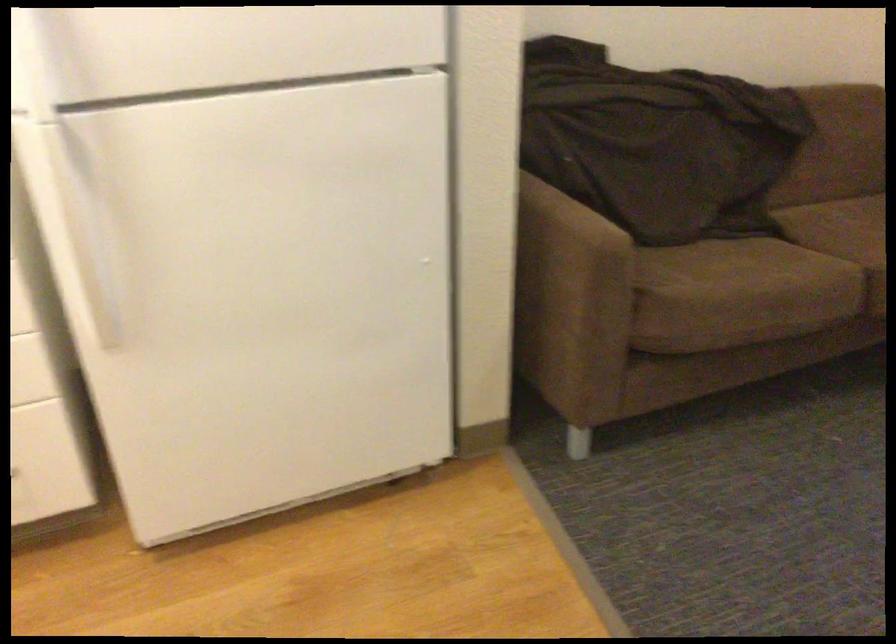
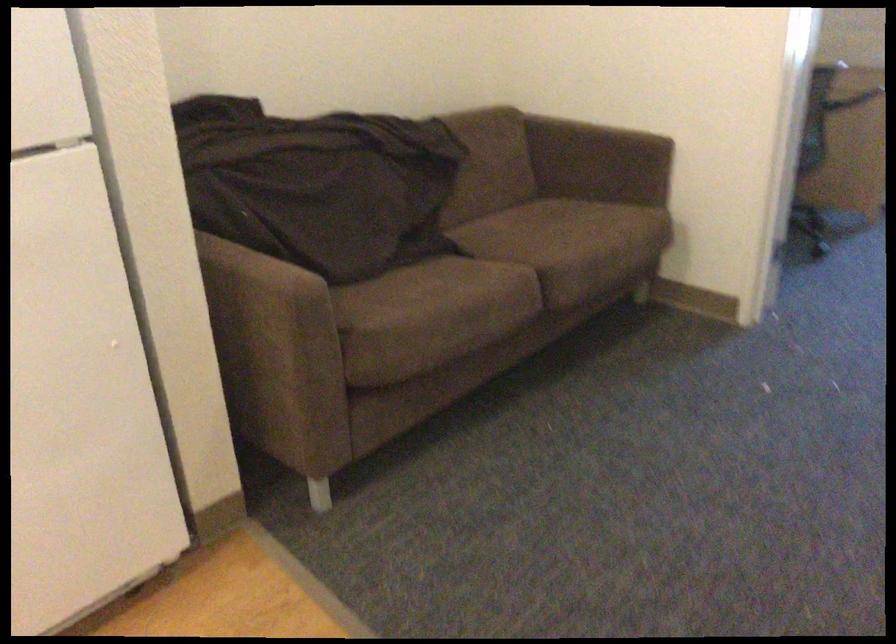
In the second image, find the point that corresponds to pixel 741 258 in the first image.

(429, 279)